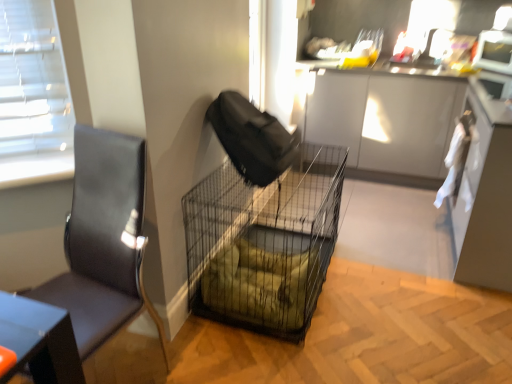
Question: Does black leather chair at left have a greater width compared to white cloth at right?

Choices:
 (A) yes
 (B) no

Answer: (A)

Question: Does black leather chair at left appear on the right side of white cloth at right?

Choices:
 (A) yes
 (B) no

Answer: (B)

Question: Considering the relative sizes of black leather chair at left and white cloth at right in the image provided, is black leather chair at left shorter than white cloth at right?

Choices:
 (A) no
 (B) yes

Answer: (A)

Question: From the image's perspective, would you say black leather chair at left is shown under white cloth at right?

Choices:
 (A) no
 (B) yes

Answer: (B)

Question: Is black leather chair at left located outside white cloth at right?

Choices:
 (A) no
 (B) yes

Answer: (B)

Question: Is black leather chair at left taller than white cloth at right?

Choices:
 (A) no
 (B) yes

Answer: (B)

Question: Can you confirm if metal mesh crate at center is smaller than black wire mesh cage at center?

Choices:
 (A) yes
 (B) no

Answer: (A)

Question: Considering the relative sizes of metal mesh crate at center and black wire mesh cage at center in the image provided, is metal mesh crate at center wider than black wire mesh cage at center?

Choices:
 (A) no
 (B) yes

Answer: (B)

Question: Is metal mesh crate at center bigger than black wire mesh cage at center?

Choices:
 (A) yes
 (B) no

Answer: (B)

Question: Is metal mesh crate at center further to the viewer compared to black wire mesh cage at center?

Choices:
 (A) yes
 (B) no

Answer: (A)

Question: From the image's perspective, is metal mesh crate at center on black wire mesh cage at center?

Choices:
 (A) no
 (B) yes

Answer: (B)

Question: Can you confirm if metal mesh crate at center is shorter than black wire mesh cage at center?

Choices:
 (A) no
 (B) yes

Answer: (B)

Question: Is the position of black leather chair at left less distant than that of metal mesh crate at center?

Choices:
 (A) yes
 (B) no

Answer: (A)